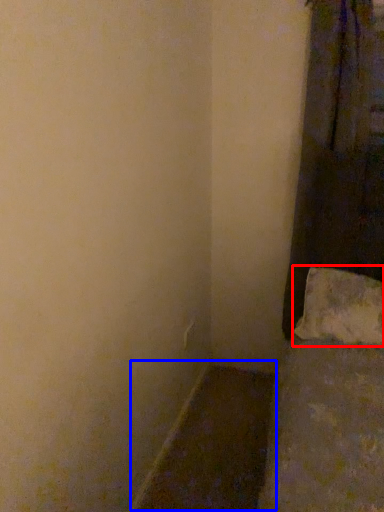
Question: Among these objects, which one is farthest to the camera, pillow (highlighted by a red box) or window sill (highlighted by a blue box)?

Choices:
 (A) pillow
 (B) window sill

Answer: (A)